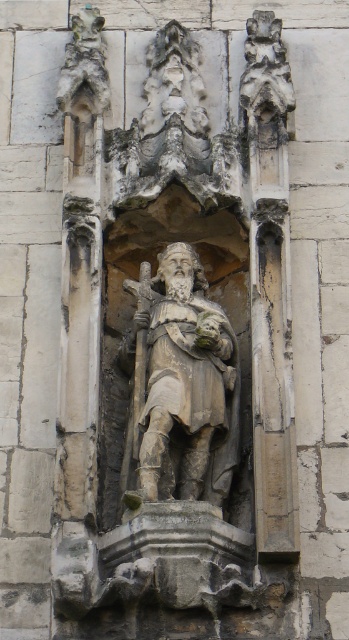
Question: In this image, where is stone statue at center located relative to carved stone ornament at upper center?

Choices:
 (A) left
 (B) right

Answer: (A)

Question: From the image, what is the correct spatial relationship of stone statue at center in relation to carved stone ornament at upper center?

Choices:
 (A) right
 (B) left

Answer: (B)

Question: Which object is closer to the camera taking this photo?

Choices:
 (A) stone statue at center
 (B) carved stone ornament at upper center

Answer: (A)

Question: Among these objects, which one is farthest from the camera?

Choices:
 (A) carved stone ornament at upper center
 (B) stone statue at center

Answer: (A)

Question: Which point is farther to the camera?

Choices:
 (A) stone statue at center
 (B) carved stone ornament at upper center

Answer: (B)

Question: Where is stone statue at center located in relation to carved stone ornament at upper center in the image?

Choices:
 (A) below
 (B) above

Answer: (A)